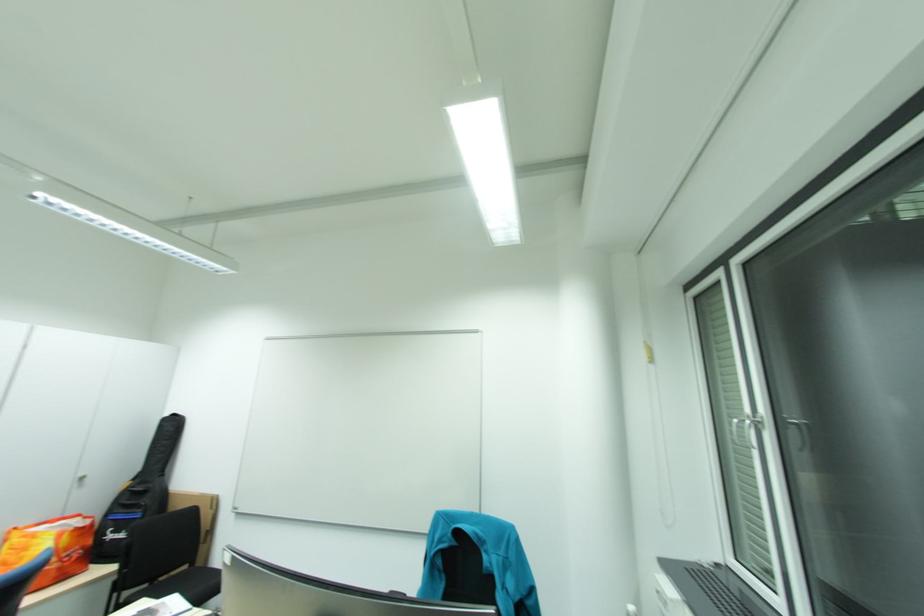
This screenshot has height=616, width=924. Find the location of `black chair sitting surface`. black chair sitting surface is located at coordinates (187, 585).